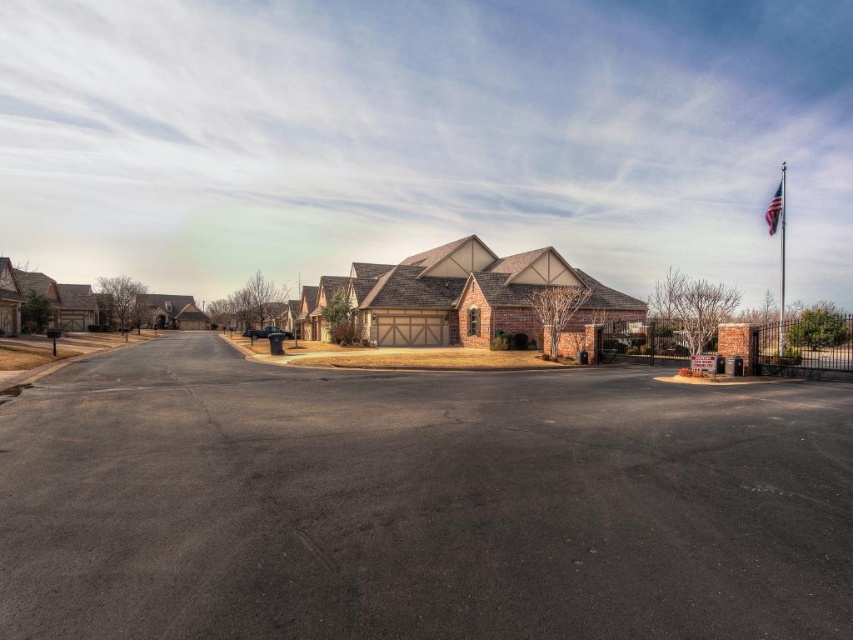
You are a delivery driver approaching the suburban neighborhood and need to park your vehicle. You see the dark asphalt parking lot at center and the american flag at upper right. Which object is shorter in height?

The dark asphalt parking lot at center is not as tall as the american flag at upper right, so the dark asphalt parking lot at center is shorter in height.

You are a pedestrian standing on the road in the suburban neighborhood scene. You see the metallic silver flag pole at right and the american flag at upper right. Which object is closer to you?

The metallic silver flag pole at right is closer to the viewer than the american flag at upper right.